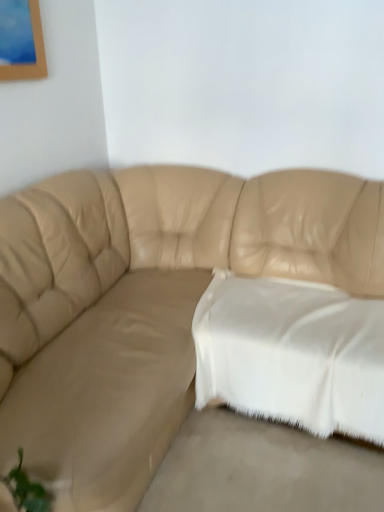
This screenshot has height=512, width=384. Describe the element at coordinates (146, 303) in the screenshot. I see `beige leather couch at center` at that location.

I want to click on white soft fabric pillow at center, so click(292, 354).

In order to click on beige leather couch at center in this screenshot , I will do tap(146, 303).

Would you say beige leather couch at center is a long distance from beige leather couch at lower left?

No, beige leather couch at center is not far from beige leather couch at lower left.

Does beige leather couch at center appear on the left side of beige leather couch at lower left?

Correct, you'll find beige leather couch at center to the left of beige leather couch at lower left.

Can you tell me how much beige leather couch at center and beige leather couch at lower left differ in facing direction?

There is a 0.483-degree angle between the facing directions of beige leather couch at center and beige leather couch at lower left.

Relative to beige leather couch at lower left, is beige leather couch at center in front or behind?

Clearly, beige leather couch at center is in front of beige leather couch at lower left.

Considering their positions, is beige leather couch at lower left located in front of or behind white soft fabric pillow at center?

Visually, beige leather couch at lower left is located in front of white soft fabric pillow at center.

Is point (361, 454) closer or farther from the camera than point (381, 350)?

Point (361, 454).

Is beige leather couch at lower left aimed at white soft fabric pillow at center?

No, beige leather couch at lower left is not oriented towards white soft fabric pillow at center.

Based on the photo, from their relative heights in the image, would you say beige leather couch at lower left is taller or shorter than white soft fabric pillow at center?

Clearly, beige leather couch at lower left is shorter compared to white soft fabric pillow at center.

Who is shorter, white soft fabric pillow at center or beige leather couch at center?

white soft fabric pillow at center.

Is beige leather couch at center a part of white soft fabric pillow at center?

No, beige leather couch at center is not inside white soft fabric pillow at center.

Does white soft fabric pillow at center touch beige leather couch at center?

No, white soft fabric pillow at center is not with beige leather couch at center.

Considering the sizes of objects beige leather couch at lower left and beige leather couch at center in the image provided, who is bigger, beige leather couch at lower left or beige leather couch at center?

beige leather couch at center.

Is point (303, 465) more distant than point (82, 503)?

Yes, point (303, 465) is farther from viewer.

Visually, is beige leather couch at lower left positioned to the left or to the right of beige leather couch at center?

beige leather couch at lower left is positioned on beige leather couch at center's right side.

Does beige leather couch at lower left have a greater height compared to beige leather couch at center?

No.

Is white soft fabric pillow at center bigger or smaller than beige leather couch at lower left?

Considering their sizes, white soft fabric pillow at center takes up more space than beige leather couch at lower left.

This screenshot has width=384, height=512. Find the location of `concrete on the left of white soft fabric pillow at center`. concrete on the left of white soft fabric pillow at center is located at coordinates (263, 468).

Who is shorter, white soft fabric pillow at center or beige leather couch at lower left?

With less height is beige leather couch at lower left.

In the scene shown: Is white soft fabric pillow at center oriented away from beige leather couch at lower left?

No, white soft fabric pillow at center is not facing the opposite direction of beige leather couch at lower left.

This screenshot has width=384, height=512. I want to click on pillow below the beige leather couch at center (from the image's perspective), so click(292, 354).

Are beige leather couch at center and white soft fabric pillow at center far apart?

No, beige leather couch at center is not far from white soft fabric pillow at center.

From the picture: Considering the positions of objects beige leather couch at center and white soft fabric pillow at center in the image provided, who is in front, beige leather couch at center or white soft fabric pillow at center?

Positioned in front is beige leather couch at center.

Can you confirm if beige leather couch at center is wider than white soft fabric pillow at center?

Indeed, beige leather couch at center has a greater width compared to white soft fabric pillow at center.

Find the location of `concrete located on the right of beige leather couch at center`. concrete located on the right of beige leather couch at center is located at coordinates (263, 468).

The image size is (384, 512). I want to click on pillow behind the beige leather couch at lower left, so click(x=292, y=354).

From the image, which object appears to be nearer to white soft fabric pillow at center, beige leather couch at center or beige leather couch at lower left?

Among the two, beige leather couch at lower left is located nearer to white soft fabric pillow at center.

Based on their spatial positions, is beige leather couch at lower left or beige leather couch at center closer to white soft fabric pillow at center?

Among the two, beige leather couch at lower left is located nearer to white soft fabric pillow at center.

Which object lies further to the anchor point beige leather couch at lower left, beige leather couch at center or white soft fabric pillow at center?

Based on the image, beige leather couch at center appears to be further to beige leather couch at lower left.

Looking at the image, which one is located closer to beige leather couch at center, white soft fabric pillow at center or beige leather couch at lower left?

Based on the image, white soft fabric pillow at center appears to be nearer to beige leather couch at center.

When comparing their distances from beige leather couch at center, does beige leather couch at lower left or white soft fabric pillow at center seem further?

Among the two, beige leather couch at lower left is located further to beige leather couch at center.

In the scene shown: Which object lies further to the anchor point beige leather couch at lower left, white soft fabric pillow at center or beige leather couch at center?

Based on the image, beige leather couch at center appears to be further to beige leather couch at lower left.

What are the coordinates of `concrete between beige leather couch at center and white soft fabric pillow at center from front to back` in the screenshot? It's located at coord(263,468).